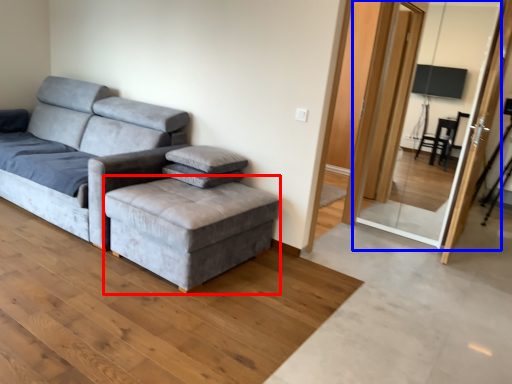
Question: Which object appears closest to the camera in this image, stool (highlighted by a red box) or screen door (highlighted by a blue box)?

Choices:
 (A) stool
 (B) screen door

Answer: (A)